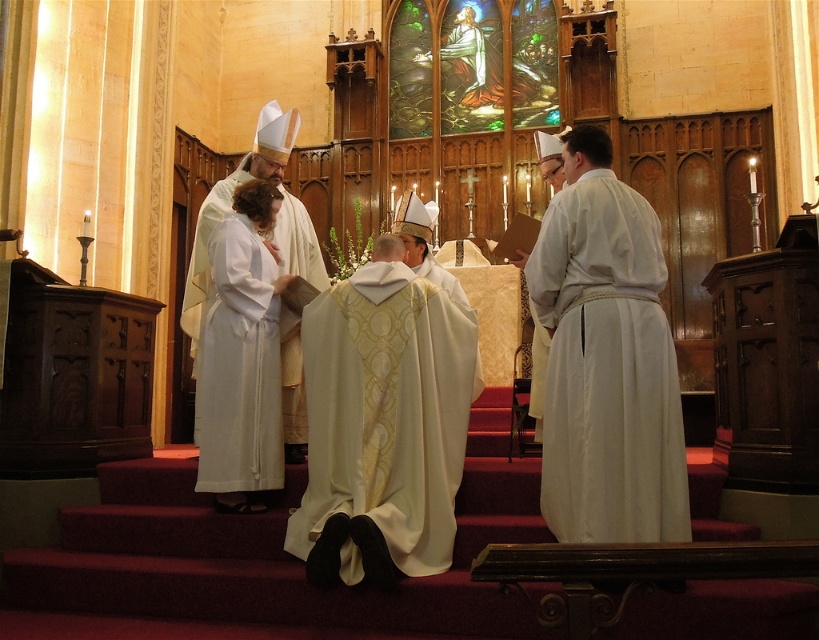
You are an observer in the church and notice two robes worn by participants. The white matte robe at right and the white satin robe at center. Which robe is covering part of the other?

The white matte robe at right is positioned over white satin robe at center, so it is covering part of the other.

You are an assistant helping to prepare for a religious ceremony. You have two robes available for the main participant. The gold embroidered robe at center and the white satin robe at center. The participant prefers a wider robe for the ceremony. Which robe should you choose?

The white satin robe at center is wider than the gold embroidered robe at center, so you should choose the white satin robe at center for the ceremony.